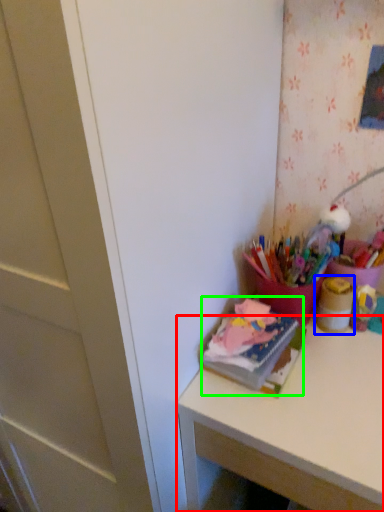
Question: Considering the real-world distances, which object is farthest from desk (highlighted by a red box)? stationery (highlighted by a blue box) or book (highlighted by a green box)?

Choices:
 (A) stationery
 (B) book

Answer: (A)